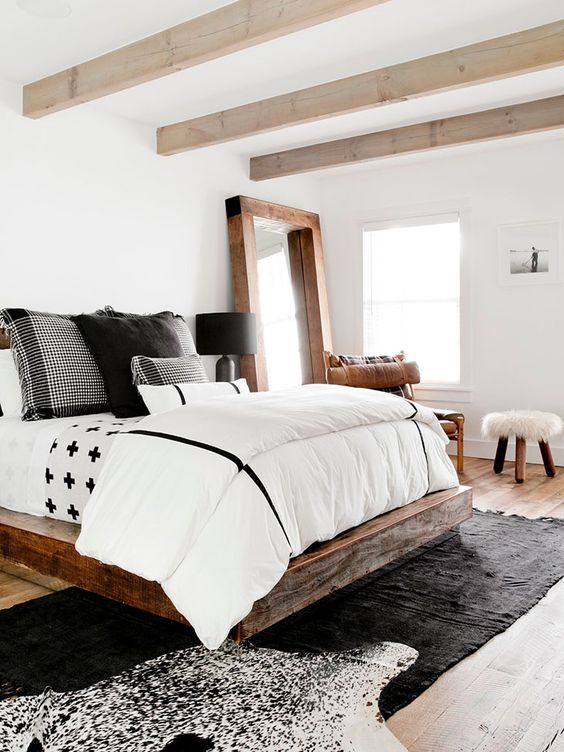
Locate an element on the screen. Image resolution: width=564 pixels, height=752 pixels. black lamp is located at coordinates (220, 341).